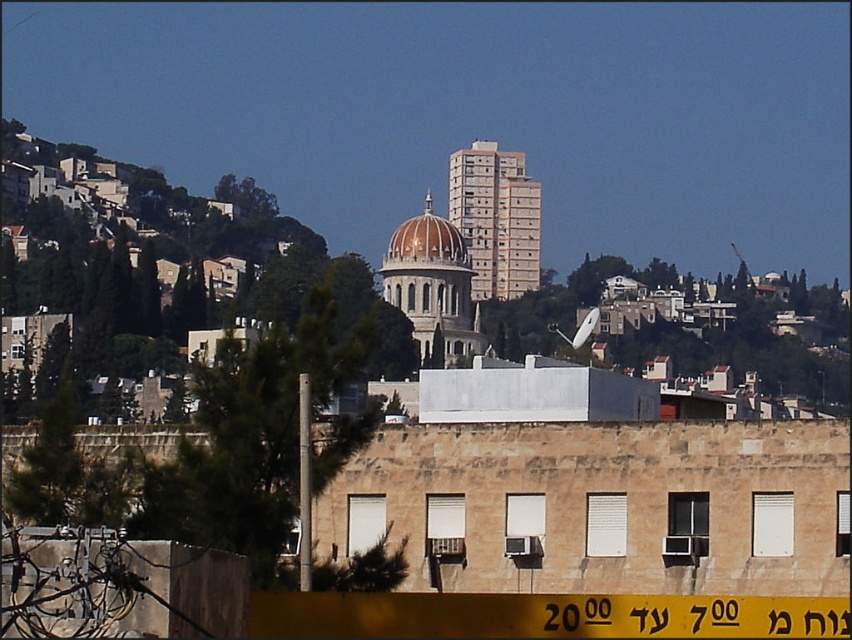
The height and width of the screenshot is (640, 852). What do you see at coordinates (432, 284) in the screenshot?
I see `golden dome building at center` at bounding box center [432, 284].

Where is `golden dome building at center`? This screenshot has height=640, width=852. golden dome building at center is located at coordinates (432, 284).

Between point (519, 211) and point (435, 310), which one is positioned behind?

The point (519, 211) is more distant.

Based on the photo, how far apart are beige concrete tower at center and golden dome building at center?

They are 56.20 meters apart.

Is point (499, 176) closer to viewer compared to point (387, 259)?

No, (499, 176) is behind (387, 259).

This screenshot has width=852, height=640. I want to click on beige concrete tower at center, so click(x=494, y=218).

Which of these two, beige concrete tower at center or golden glass dome at center, stands taller?

beige concrete tower at center

Is beige concrete tower at center to the left of golden glass dome at center from the viewer's perspective?

In fact, beige concrete tower at center is to the right of golden glass dome at center.

Locate an element on the screen. This screenshot has width=852, height=640. beige concrete tower at center is located at coordinates (494, 218).